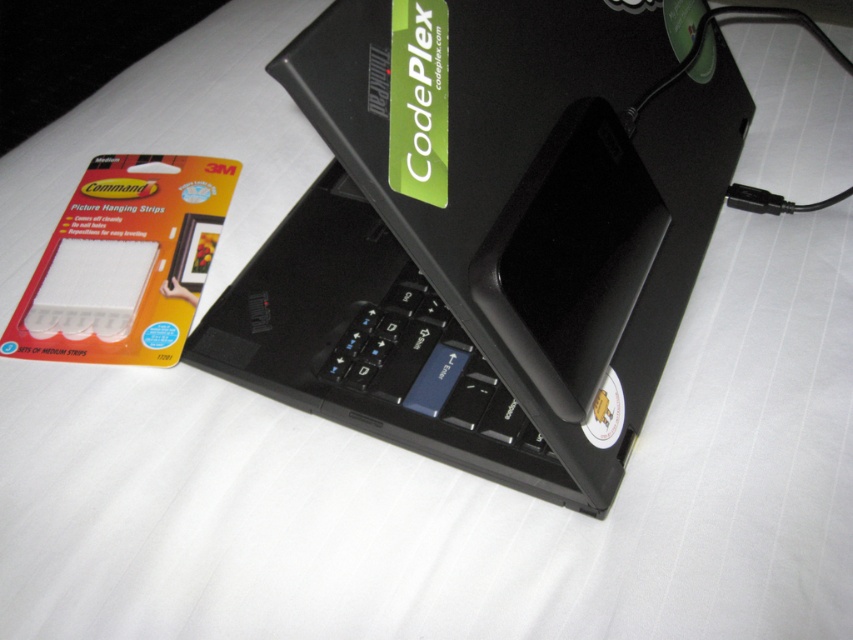
Question: Is black plastic laptop at center to the right of black matte keyboard at center from the viewer's perspective?

Choices:
 (A) yes
 (B) no

Answer: (A)

Question: Can you confirm if black plastic laptop at center is positioned below black matte keyboard at center?

Choices:
 (A) yes
 (B) no

Answer: (B)

Question: Which point is closer to the camera?

Choices:
 (A) (506, 440)
 (B) (361, 316)

Answer: (A)

Question: Which of the following is the closest to the observer?

Choices:
 (A) black matte keyboard at center
 (B) black plastic laptop at center

Answer: (B)

Question: Can you confirm if black plastic laptop at center is positioned to the left of black matte keyboard at center?

Choices:
 (A) no
 (B) yes

Answer: (A)